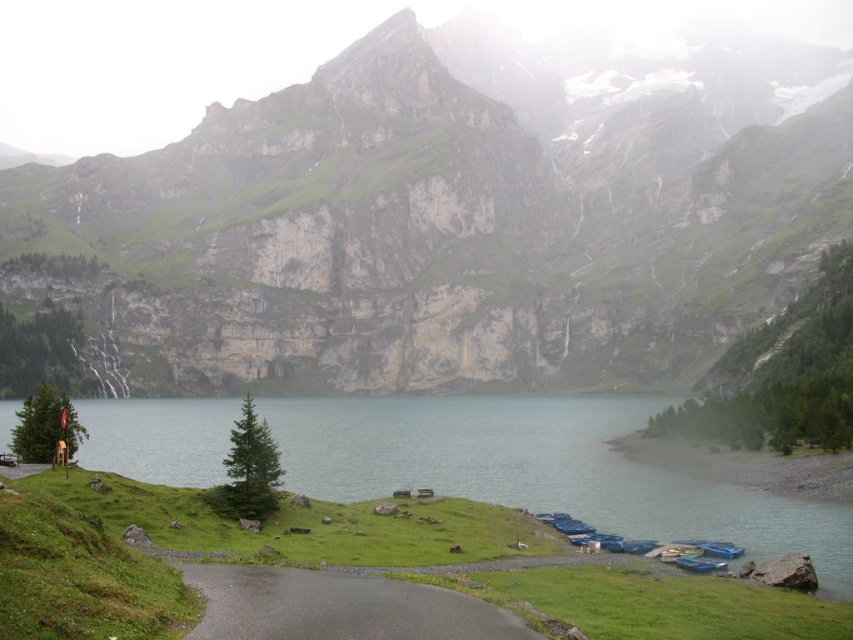
Can you confirm if green rock at center is wider than green grassy lake at lower center?

Indeed, green rock at center has a greater width compared to green grassy lake at lower center.

Can you confirm if green rock at center is positioned below green grassy lake at lower center?

No, green rock at center is not below green grassy lake at lower center.

Find the location of a particular element. This screenshot has width=853, height=640. green rock at center is located at coordinates (450, 216).